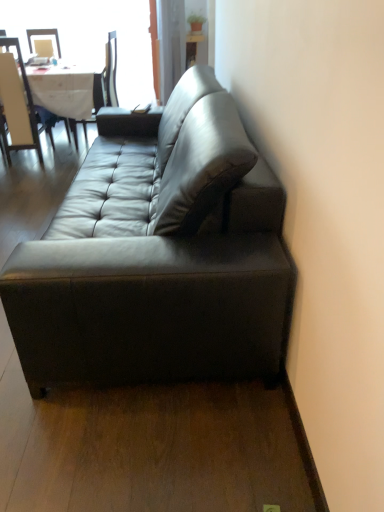
Question: Is matte black chair at upper left, the second chair in the left-to-right sequence, a part of light beige wood chair at upper left, which is the second chair from right to left?

Choices:
 (A) no
 (B) yes

Answer: (A)

Question: Can you confirm if light beige wood chair at upper left, which is the second chair from right to left, is positioned to the left of matte black chair at upper left, the second chair in the left-to-right sequence?

Choices:
 (A) yes
 (B) no

Answer: (A)

Question: Can you confirm if light beige wood chair at upper left, the first chair viewed from the left, is smaller than matte black chair at upper left, the first chair viewed from the right?

Choices:
 (A) yes
 (B) no

Answer: (A)

Question: Is light beige wood chair at upper left, which is the second chair from right to left, oriented towards matte black chair at upper left, the second chair in the left-to-right sequence?

Choices:
 (A) no
 (B) yes

Answer: (A)

Question: Considering the relative positions of light beige wood chair at upper left, which is the second chair from right to left, and matte black chair at upper left, the second chair in the left-to-right sequence, in the image provided, is light beige wood chair at upper left, which is the second chair from right to left, in front of matte black chair at upper left, the second chair in the left-to-right sequence,?

Choices:
 (A) yes
 (B) no

Answer: (A)

Question: From a real-world perspective, is light beige wood chair at upper left, which is the second chair from right to left, physically above matte black chair at upper left, the second chair in the left-to-right sequence?

Choices:
 (A) no
 (B) yes

Answer: (A)

Question: Is white cloth table at upper left in front of light beige wood chair at upper left, which is the second chair from right to left?

Choices:
 (A) no
 (B) yes

Answer: (A)

Question: Is white cloth table at upper left surrounding light beige wood chair at upper left, the first chair viewed from the left?

Choices:
 (A) yes
 (B) no

Answer: (A)

Question: Can you confirm if white cloth table at upper left is shorter than light beige wood chair at upper left, which is the second chair from right to left?

Choices:
 (A) no
 (B) yes

Answer: (B)

Question: From the image's perspective, is white cloth table at upper left located above light beige wood chair at upper left, the first chair viewed from the left?

Choices:
 (A) no
 (B) yes

Answer: (B)

Question: From a real-world perspective, is white cloth table at upper left physically below light beige wood chair at upper left, the first chair viewed from the left?

Choices:
 (A) yes
 (B) no

Answer: (A)

Question: Would you say white cloth table at upper left is a long distance from light beige wood chair at upper left, the first chair viewed from the left?

Choices:
 (A) no
 (B) yes

Answer: (A)

Question: From a real-world perspective, is matte black chair at upper left, the first chair viewed from the right, under transparent glass window at upper left?

Choices:
 (A) yes
 (B) no

Answer: (A)